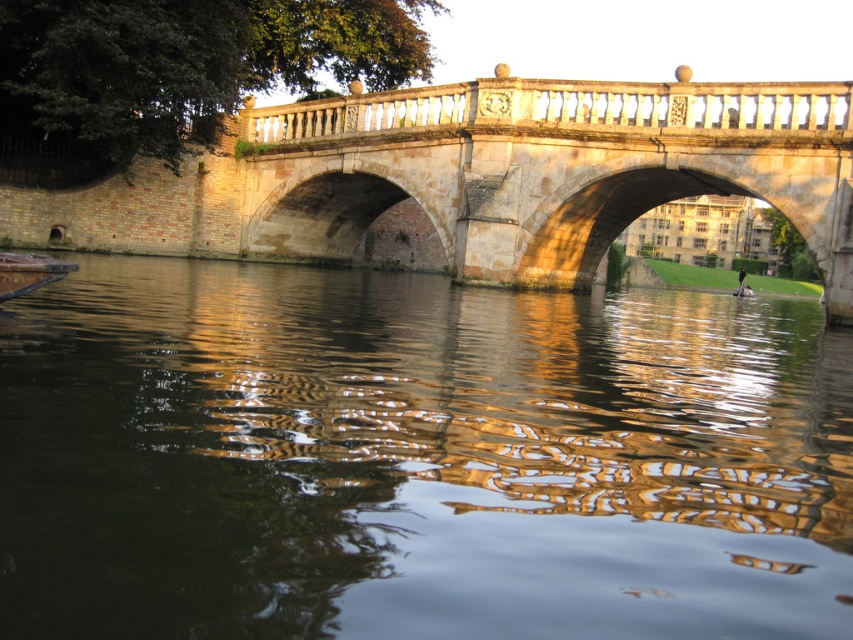
Question: Observing the image, what is the correct spatial positioning of dark brown water at center in reference to stone bridge at center?

Choices:
 (A) below
 (B) above

Answer: (A)

Question: Does dark brown water at center have a greater width compared to stone bridge at center?

Choices:
 (A) yes
 (B) no

Answer: (A)

Question: Which point appears closest to the camera in this image?

Choices:
 (A) (166, 330)
 (B) (618, 113)

Answer: (A)

Question: Can you confirm if dark brown water at center is wider than stone bridge at center?

Choices:
 (A) yes
 (B) no

Answer: (A)

Question: Which point appears farthest from the camera in this image?

Choices:
 (A) (91, 276)
 (B) (463, 241)

Answer: (B)

Question: Which point is farther to the camera?

Choices:
 (A) (x=451, y=177)
 (B) (x=732, y=486)

Answer: (A)